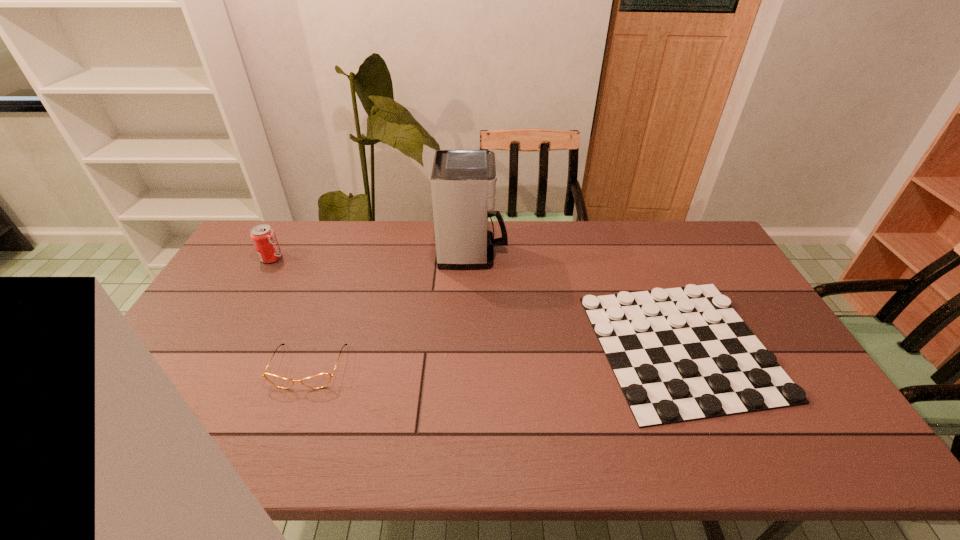
The height and width of the screenshot is (540, 960). In order to click on free point between the tallest object and the third shortest object in this screenshot , I will do `click(372, 255)`.

Identify the location of object that is the nearest to the third object from right to left. (264, 239).

Identify the location of object that can be found as the second closest to the rightmost object. Image resolution: width=960 pixels, height=540 pixels. (318, 381).

Identify the location of vacant space that satisfies the following two spatial constraints: 1. on the front panel of the third object from left to right; 2. on the front-facing side of the third object from right to left. The width and height of the screenshot is (960, 540). (471, 367).

Find the location of a particular element. Image resolution: width=960 pixels, height=540 pixels. free space in the image that satisfies the following two spatial constraints: 1. on the front panel of the tallest object; 2. on the right side of the gameboard is located at coordinates pos(471,346).